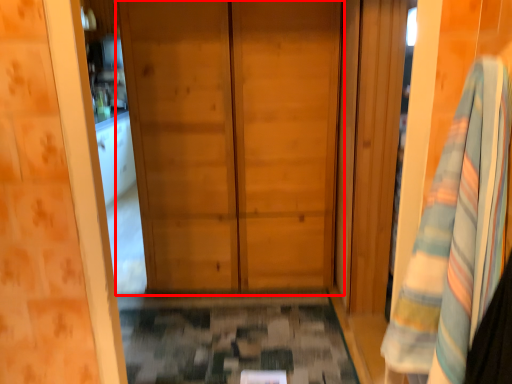
Question: From the image's perspective, considering the relative positions of door (annotated by the red box) and bath towel in the image provided, where is door (annotated by the red box) located with respect to the staircase?

Choices:
 (A) below
 (B) above

Answer: (B)